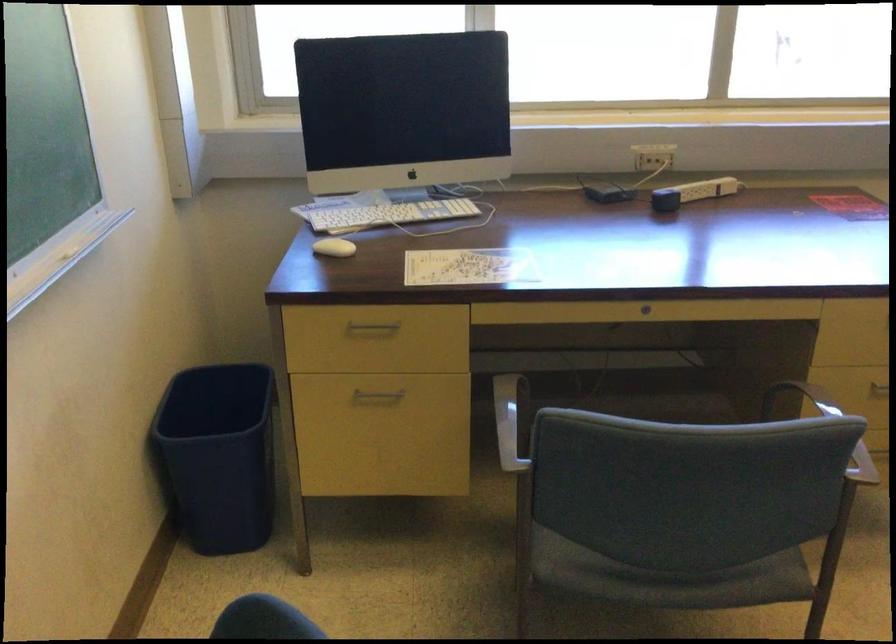
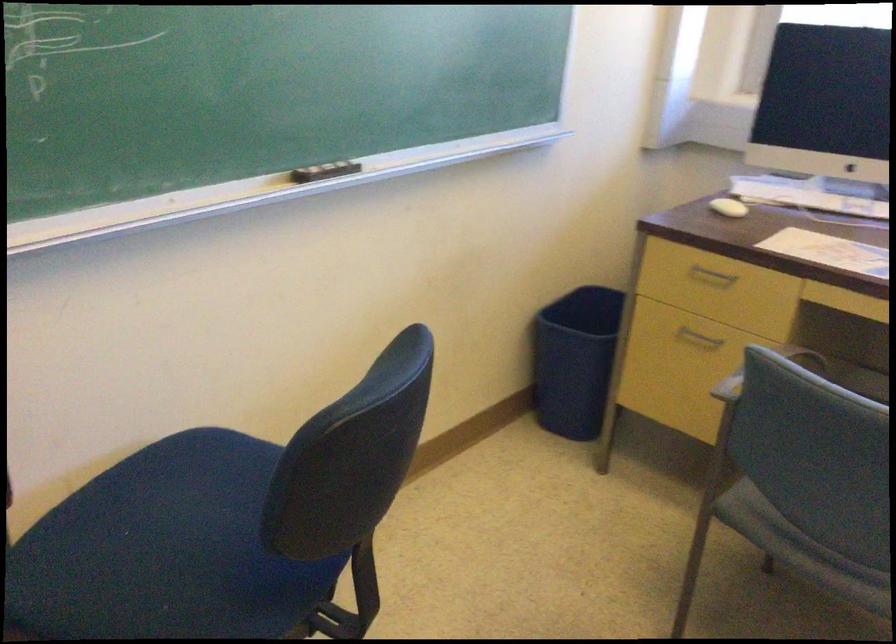
Find the pixel in the second image that matches (371,399) in the first image.

(698, 337)